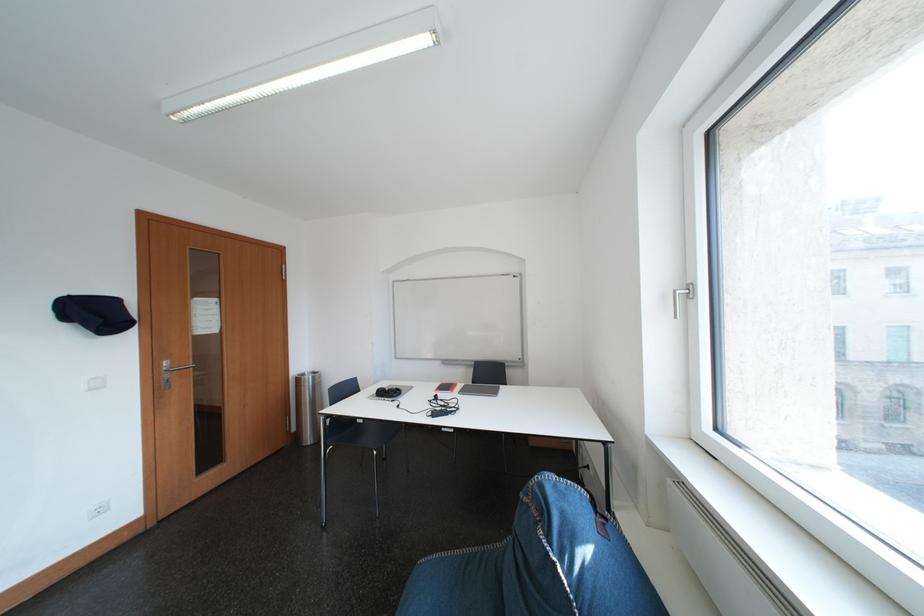
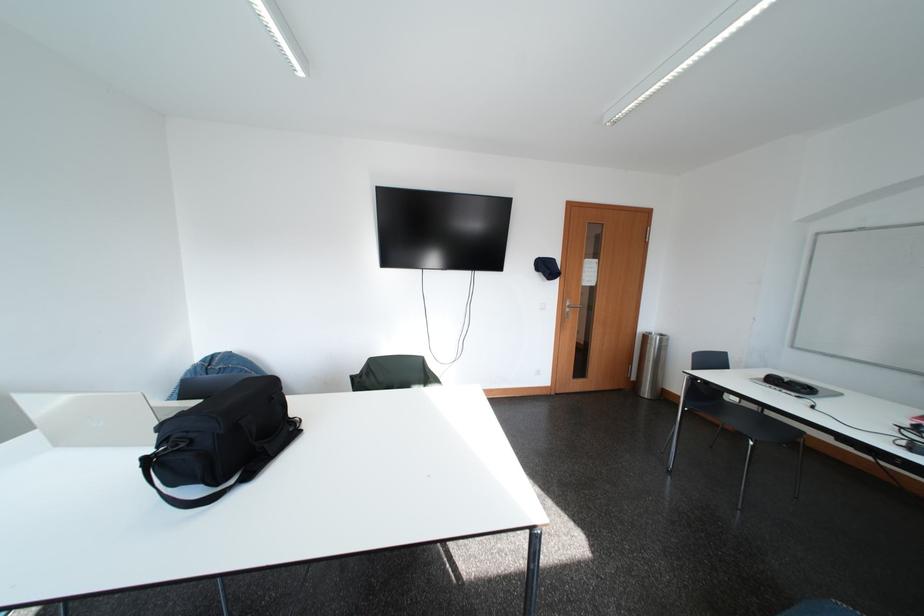
Question: The camera is either moving clockwise (left) or counter-clockwise (right) around the object. The first image is from the beginning of the video and the second image is from the end. Is the camera moving left or right when shooting the video?

Choices:
 (A) Left
 (B) Right

Answer: (B)